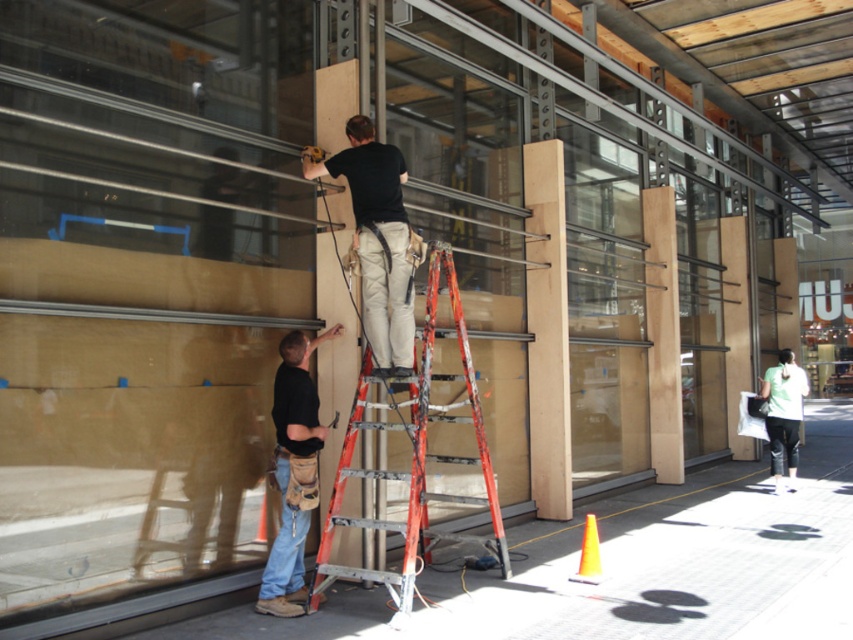
You are a safety inspector observing the construction scene. You notice two workers wearing denim jeans at lower left and green fabric shirt at lower right. Which worker is wearing clothing with a narrower width?

The denim jeans at lower left is thinner than the green fabric shirt at lower right, so the worker wearing denim jeans at lower left has clothing with a narrower width.

You are a safety inspector assessing the scene. You notice two points marked on the glass panel where workers are standing. The first point is at coordinates (457,403) and the second at (299,394). Which point is closer to your vantage point as the inspector?

Point (457,403) is further to the viewer than point (299,394), so the point closer to your vantage point is point (299,394).